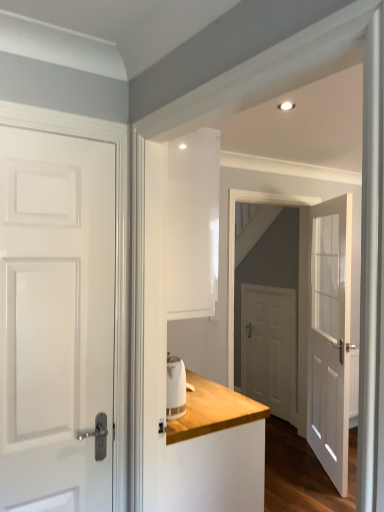
Question: Should I look upward or downward to see white glossy door at center?

Choices:
 (A) down
 (B) up

Answer: (A)

Question: Is white wood dresser at center a part of white glossy door at left, positioned as the first door in front-to-back order?

Choices:
 (A) yes
 (B) no

Answer: (B)

Question: From the image's perspective, does white glossy door at left, placed as the 3th door when sorted from right to left, appear lower than white wood dresser at center?

Choices:
 (A) yes
 (B) no

Answer: (B)

Question: Considering the relative sizes of white glossy door at left, placed as the 3th door when sorted from right to left, and white wood dresser at center in the image provided, is white glossy door at left, placed as the 3th door when sorted from right to left, taller than white wood dresser at center?

Choices:
 (A) yes
 (B) no

Answer: (A)

Question: Is white glossy door at left, placed as the 3th door when sorted from right to left, in contact with white wood dresser at center?

Choices:
 (A) yes
 (B) no

Answer: (B)

Question: Is white glossy door at left, positioned as the first door in front-to-back order, not inside white wood dresser at center?

Choices:
 (A) yes
 (B) no

Answer: (A)

Question: Is white glossy door at left, the third door from the back, facing away from white wood dresser at center?

Choices:
 (A) no
 (B) yes

Answer: (A)

Question: Is white wood dresser at center beside white glass door at center, marked as the second door in a front-to-back arrangement?

Choices:
 (A) no
 (B) yes

Answer: (A)

Question: From the image's perspective, is white wood dresser at center beneath white glass door at center, the first door when ordered from right to left?

Choices:
 (A) no
 (B) yes

Answer: (B)

Question: From a real-world perspective, is white wood dresser at center over white glass door at center, marked as the second door in a front-to-back arrangement?

Choices:
 (A) yes
 (B) no

Answer: (B)

Question: Could you tell me if white wood dresser at center is turned towards white glass door at center, the 2th door from the back?

Choices:
 (A) no
 (B) yes

Answer: (B)

Question: Is white wood dresser at center taller than white glass door at center, the first door when ordered from right to left?

Choices:
 (A) no
 (B) yes

Answer: (A)

Question: Does white wood dresser at center have a greater width compared to white glass door at center, the 2th door from the back?

Choices:
 (A) no
 (B) yes

Answer: (B)

Question: Considering the relative sizes of white glass door at center, the first door when ordered from right to left, and white glossy door at center in the image provided, is white glass door at center, the first door when ordered from right to left, shorter than white glossy door at center?

Choices:
 (A) no
 (B) yes

Answer: (B)